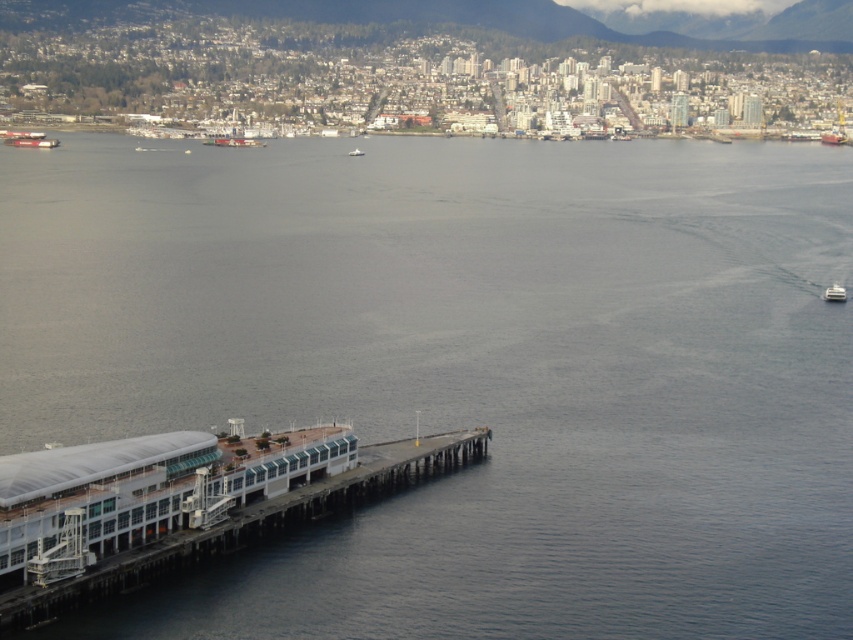
Can you confirm if metallic gray ship at left is smaller than white plastic boat at lower right?

No.

Who is lower down, metallic gray ship at left or white plastic boat at lower right?

white plastic boat at lower right

Is point (32, 134) behind point (840, 292)?

Yes, point (32, 134) is farther from viewer.

The image size is (853, 640). In order to click on metallic gray ship at left in this screenshot , I will do `click(27, 138)`.

Does point (67, 584) come farther from viewer compared to point (843, 292)?

No, it is in front of (843, 292).

Which is more to the right, metallic gray pier at lower left or white plastic boat at lower right?

white plastic boat at lower right

Where is `metallic gray pier at lower left`? metallic gray pier at lower left is located at coordinates (180, 502).

Find the location of `metallic gray pier at lower left`. metallic gray pier at lower left is located at coordinates (180, 502).

Can you confirm if metallic gray pier at lower left is positioned to the right of white plastic boat at center?

Incorrect, metallic gray pier at lower left is not on the right side of white plastic boat at center.

The height and width of the screenshot is (640, 853). In order to click on metallic gray pier at lower left in this screenshot , I will do `click(180, 502)`.

Who is more forward, (189,516) or (352,156)?

Point (189,516) is more forward.

This screenshot has width=853, height=640. I want to click on metallic gray pier at lower left, so click(180, 502).